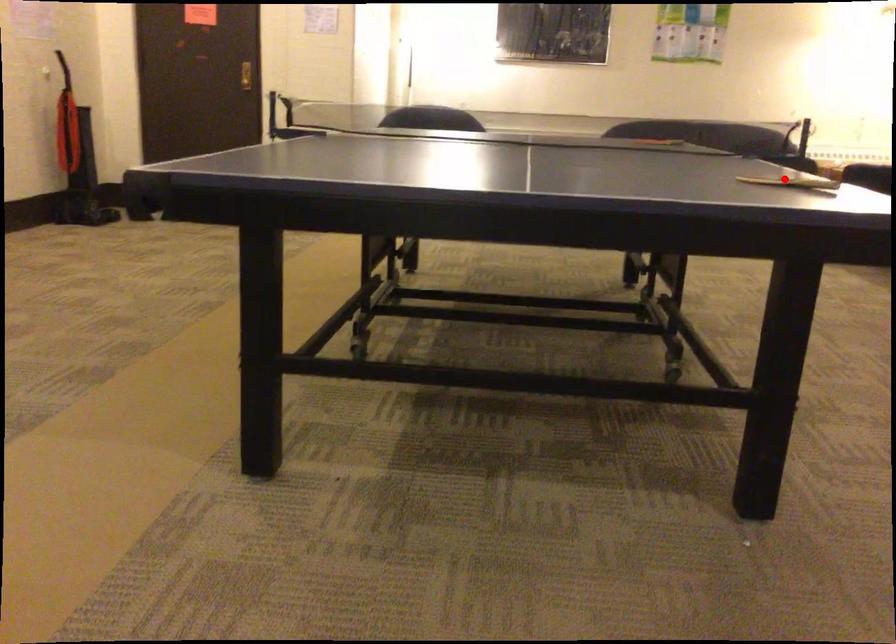
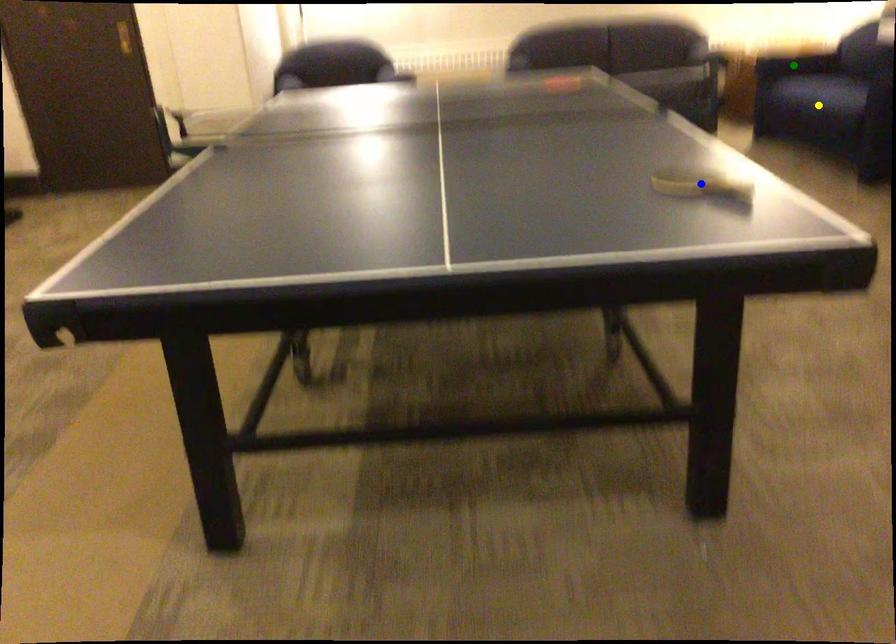
Question: I am providing you with two images of the same scene from different viewpoints. A red point is marked on the first image. You are given multiple points on the second image. Which mark in image 2 goes with the point in image 1?

Choices:
 (A) blue point
 (B) green point
 (C) yellow point

Answer: (A)